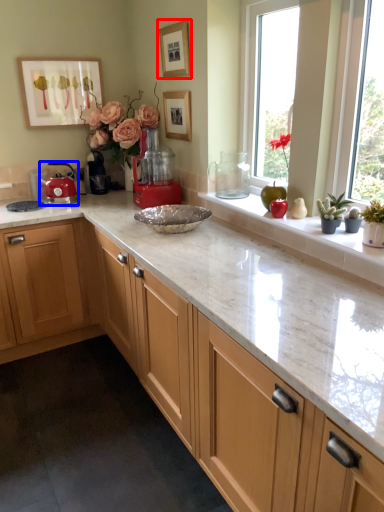
Question: Among these objects, which one is farthest to the camera, picture frame (highlighted by a red box) or kitchen appliance (highlighted by a blue box)?

Choices:
 (A) picture frame
 (B) kitchen appliance

Answer: (B)